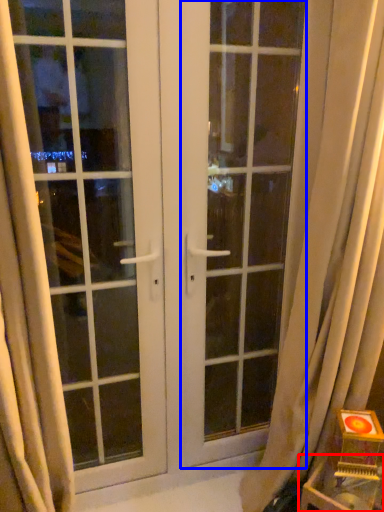
Question: Which of the following is the closest to the observer, furniture (highlighted by a red box) or screen door (highlighted by a blue box)?

Choices:
 (A) furniture
 (B) screen door

Answer: (A)